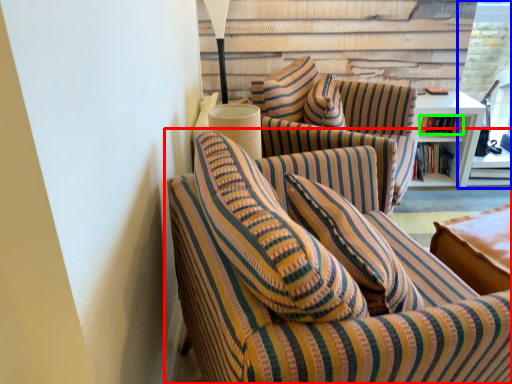
Question: Estimate the real-world distances between objects in this image. Which object is farther from studio couch (highlighted by a red box), glass door (highlighted by a blue box) or book (highlighted by a green box)?

Choices:
 (A) glass door
 (B) book

Answer: (A)